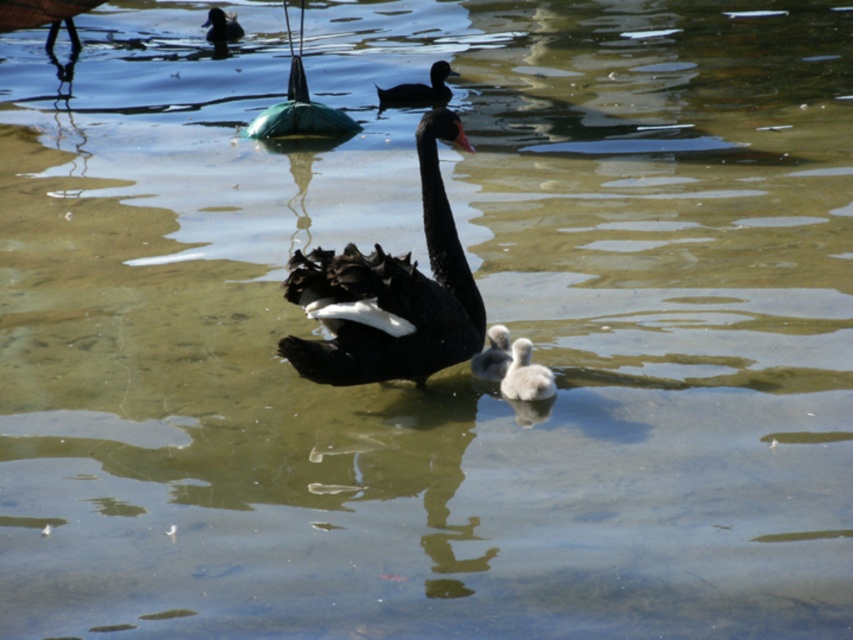
You are a wildlife photographer aiming to capture a closeup of the black glossy goose at center and the white fluffy goose at center. Given that your camera lens has a maximum width coverage of 1.2 meters, can you fit both geese in the frame without moving the camera?

The black glossy goose at center might be wider than white fluffy goose at center, but the total width of both together is not specified. Without knowing the exact combined width, it is uncertain if the camera lens can capture both within the 1.2 meters coverage. Further measurement is needed.

You are a photographer trying to capture the black glossy goose at center in the image. The camera you are using has a focus point at point (390, 294). Will this focus point be effective for capturing the black glossy goose at center?

The black glossy goose at center is located at point (390, 294), so yes, the focus point at (390, 294) will be effective for capturing the black glossy goose at center.

You are a wildlife photographer observing the scene. You need to determine which bird is taller between the black glossy goose at center and the black glossy duck at upper left. Which one is taller?

The black glossy goose at center is taller than the black glossy duck at upper left.